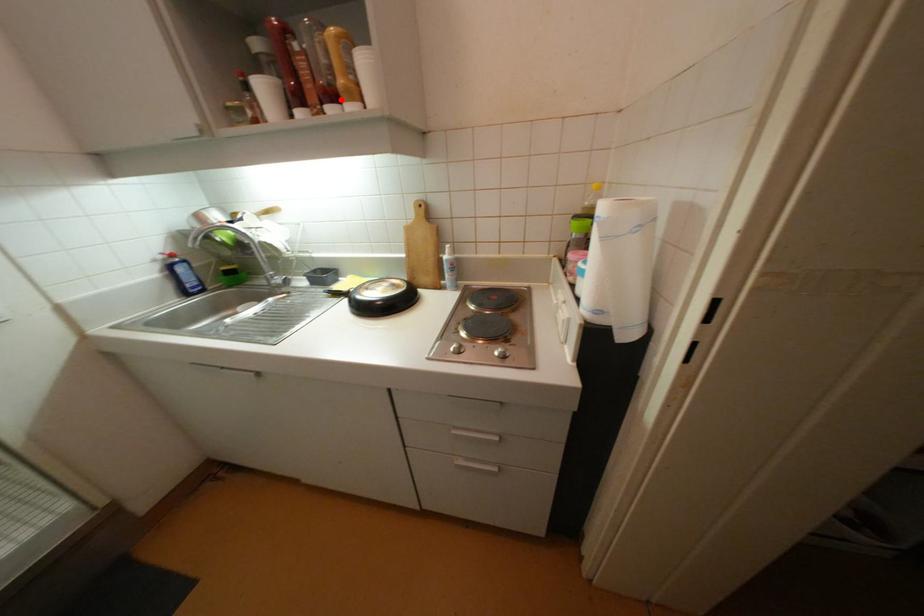
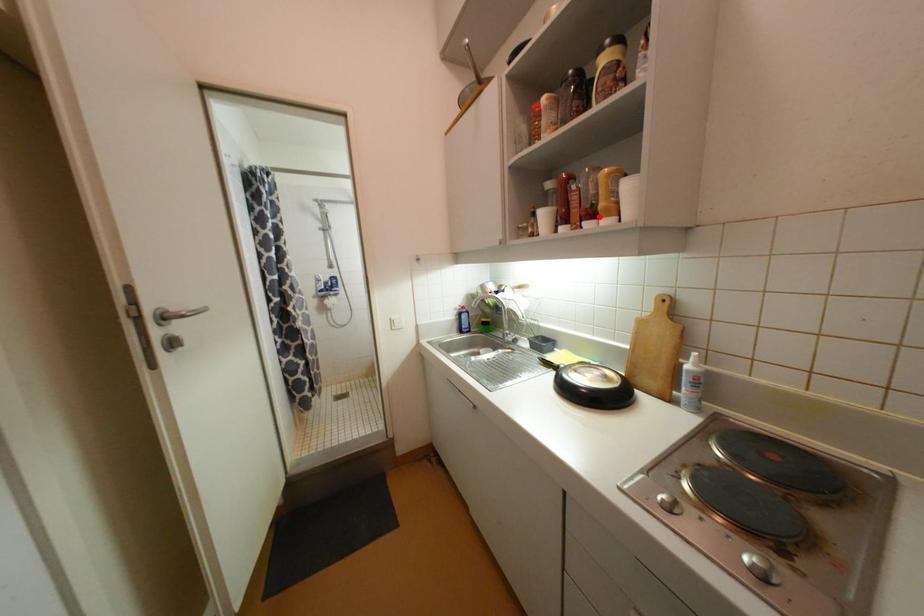
I am providing you with two images of the same scene from different viewpoints. A red point is marked on the first image and another point is marked on the second image. Is the marked point in image1 the same physical position as the marked point in image2?

Yes